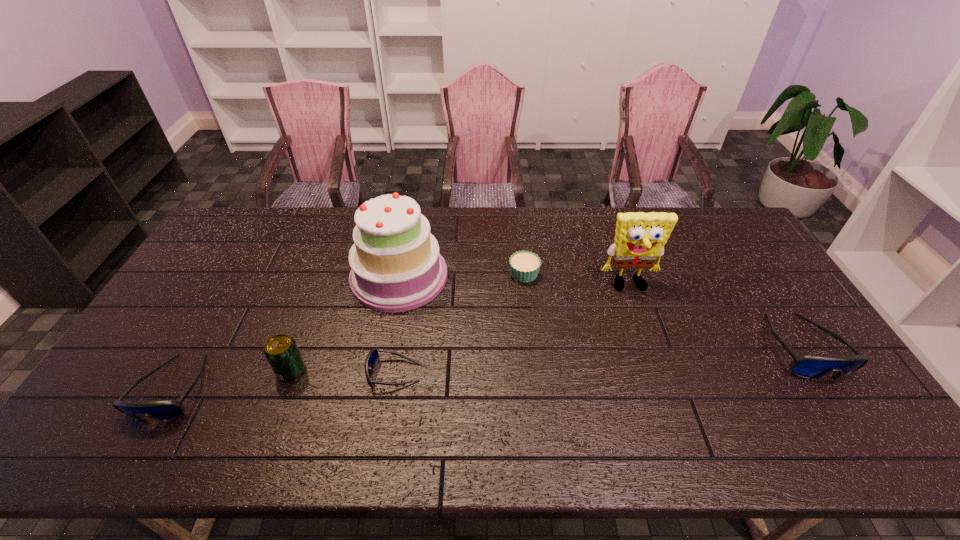
Identify the location of vacant space located on the front-facing side of the second sunglasses from right to left. This screenshot has width=960, height=540. (303, 373).

I want to click on vacant space located on the front-facing side of the second sunglasses from right to left, so click(276, 373).

I want to click on free space located on the right of the cupcake, so click(x=644, y=273).

You are a GUI agent. You are given a task and a screenshot of the screen. Output one action in this format:
    pyautogui.click(x=<x>, y=<y>)
    Task: Click on the blank space located 0.240m on the right of the cake
    
    Given the screenshot: What is the action you would take?
    pyautogui.click(x=521, y=276)

You are a GUI agent. You are given a task and a screenshot of the screen. Output one action in this format:
    pyautogui.click(x=<x>, y=<y>)
    Task: Click on the free space located on the face of the second object from right to left
    
    Given the screenshot: What is the action you would take?
    pyautogui.click(x=648, y=340)

Where is `vacant space located on the left of the third tallest object`? The image size is (960, 540). vacant space located on the left of the third tallest object is located at coordinates (258, 370).

Where is `object present at the far edge`? The width and height of the screenshot is (960, 540). object present at the far edge is located at coordinates (396, 266).

The image size is (960, 540). I want to click on beer can present at the near edge, so click(x=281, y=351).

Identify the location of object at the left edge. The height and width of the screenshot is (540, 960). click(164, 410).

At what (x,y) coordinates should I click in order to perform the action: click on object situated at the right edge. Please return your answer as a coordinate pair (x, y). Image resolution: width=960 pixels, height=540 pixels. Looking at the image, I should click on (808, 366).